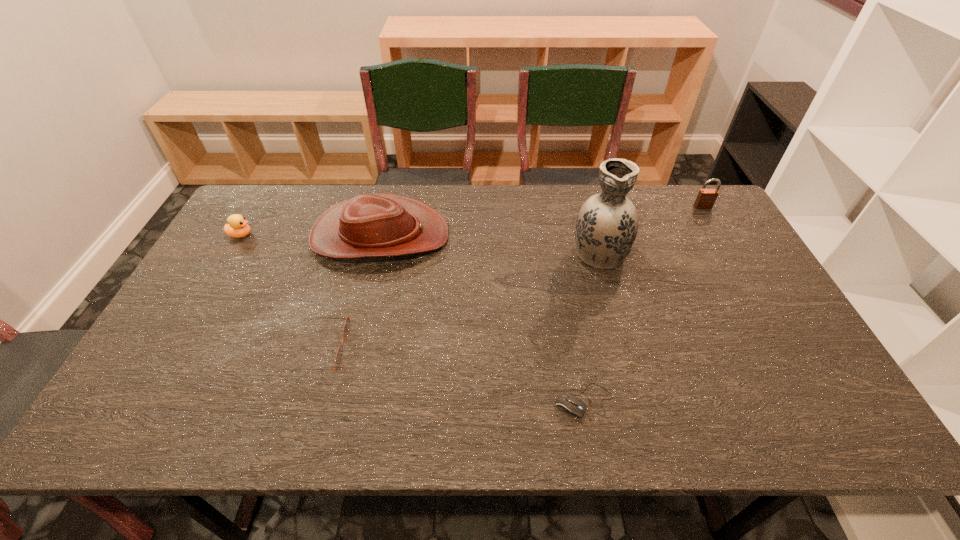
You are a GUI agent. You are given a task and a screenshot of the screen. Output one action in this format:
    pyautogui.click(x=<x>, y=<y>)
    Task: Click on the free region located with the handle on the side of the tallest object
    The image size is (960, 540).
    Given the screenshot: What is the action you would take?
    pyautogui.click(x=590, y=221)

This screenshot has height=540, width=960. What are the coordinates of `vacant space located with the handle on the side of the tallest object` in the screenshot? It's located at (582, 190).

Find the location of a particular element. free region located on the front-facing side of the cowboy hat is located at coordinates (559, 235).

What are the coordinates of `vacant space situated 0.270m on the front-facing side of the rightmost object` in the screenshot? It's located at (736, 265).

Where is `vacant region located 0.250m on the face of the fourth tallest object`? The image size is (960, 540). vacant region located 0.250m on the face of the fourth tallest object is located at coordinates (332, 235).

Locate an element on the screen. The height and width of the screenshot is (540, 960). vacant space located on the face of the second shortest object is located at coordinates (385, 348).

Find the location of `vacant area located on the left of the computer mouse`. vacant area located on the left of the computer mouse is located at coordinates (453, 401).

Where is `cowboy hat present at the far edge`? This screenshot has width=960, height=540. cowboy hat present at the far edge is located at coordinates (369, 225).

Locate an element on the screen. This screenshot has width=960, height=540. padlock located in the far edge section of the desktop is located at coordinates (706, 198).

Identify the location of object that is at the near edge. This screenshot has height=540, width=960. (570, 405).